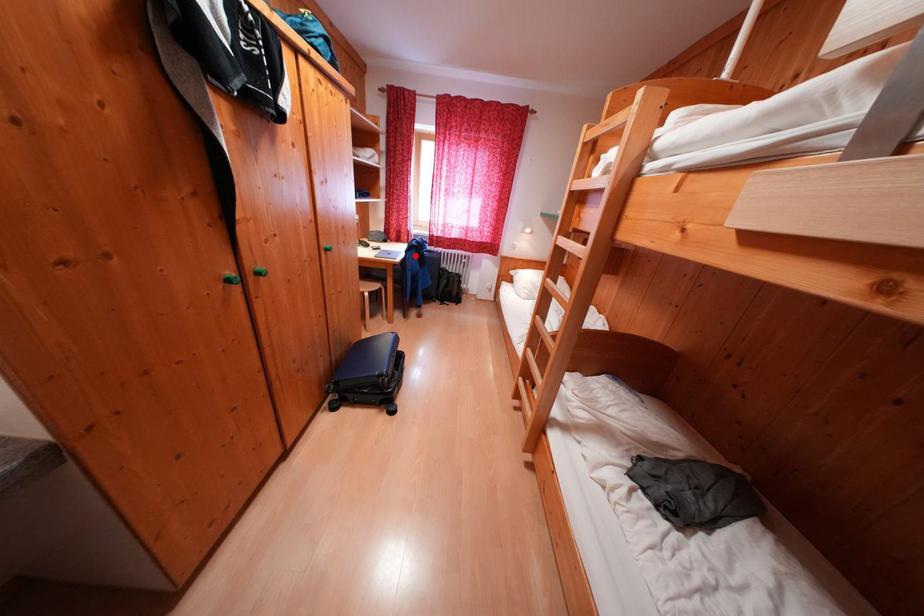
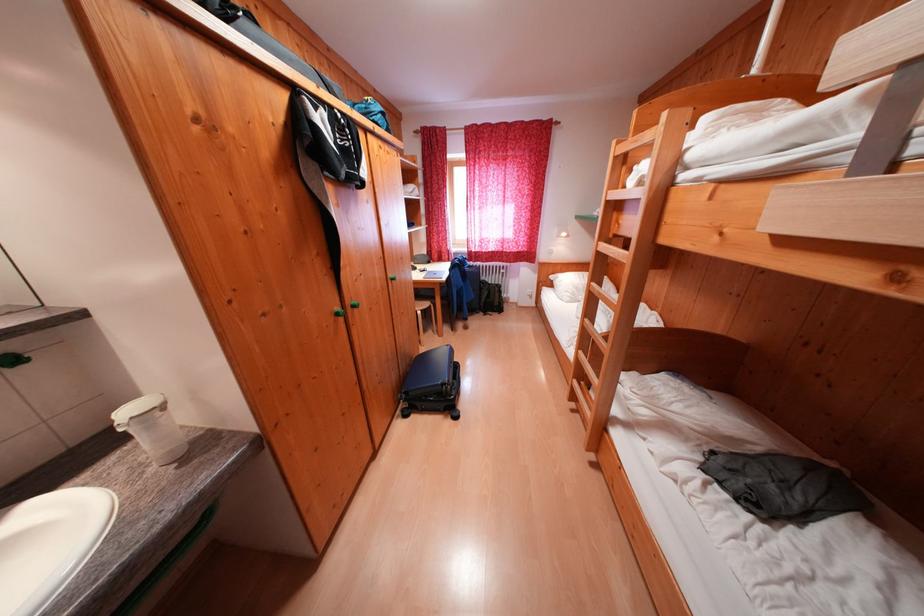
In the second image, find the point that corresponds to the highlighted location in the first image.

(458, 274)